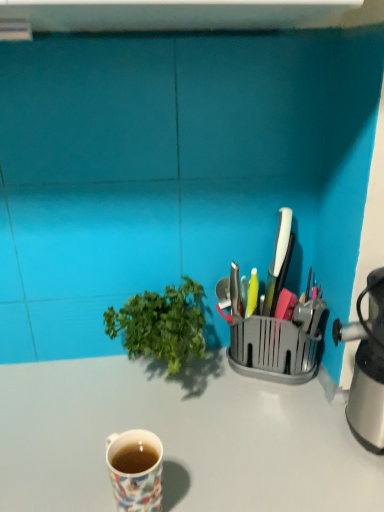
In order to click on free point to the right of floral ceramic mug at lower left in this screenshot , I will do `click(237, 470)`.